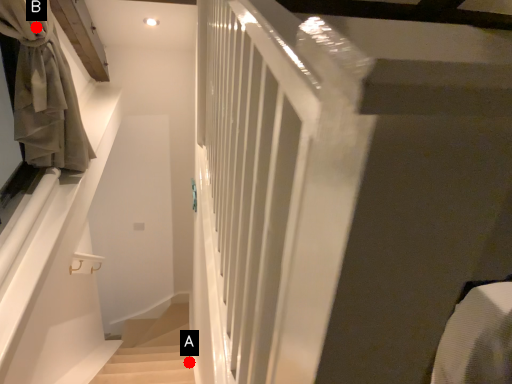
Question: Two points are circled on the image, labeled by A and B beside each circle. Which point is closer to the camera?

Choices:
 (A) A is closer
 (B) B is closer

Answer: (B)